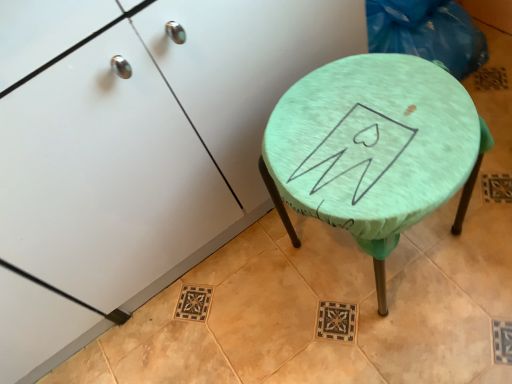
Question: Is teal fabric-covered stool at center in front of or behind mint fabric-covered stool at center-right in the image?

Choices:
 (A) front
 (B) behind

Answer: (B)

Question: Considering the positions of teal fabric-covered stool at center and mint fabric-covered stool at center-right in the image, is teal fabric-covered stool at center wider or thinner than mint fabric-covered stool at center-right?

Choices:
 (A) wide
 (B) thin

Answer: (B)

Question: Considering the positions of point (452, 228) and point (115, 29), is point (452, 228) closer or farther from the camera than point (115, 29)?

Choices:
 (A) farther
 (B) closer

Answer: (A)

Question: Choose the correct answer: Is mint fabric-covered stool at center-right inside teal fabric-covered stool at center or outside it?

Choices:
 (A) outside
 (B) inside

Answer: (A)

Question: In terms of width, does mint fabric-covered stool at center-right look wider or thinner when compared to teal fabric-covered stool at center?

Choices:
 (A) wide
 (B) thin

Answer: (A)

Question: Considering the relative positions of mint fabric-covered stool at center-right and teal fabric-covered stool at center in the image provided, is mint fabric-covered stool at center-right to the left or to the right of teal fabric-covered stool at center?

Choices:
 (A) left
 (B) right

Answer: (A)

Question: From a real-world perspective, is mint fabric-covered stool at center-right positioned above or below teal fabric-covered stool at center?

Choices:
 (A) above
 (B) below

Answer: (A)